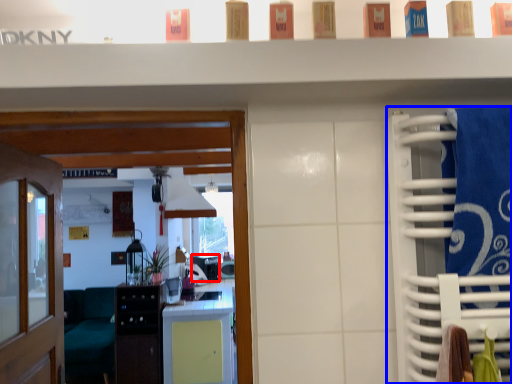
Question: Which point is closer to the camera, appliance (highlighted by a red box) or closet (highlighted by a blue box)?

Choices:
 (A) appliance
 (B) closet

Answer: (B)